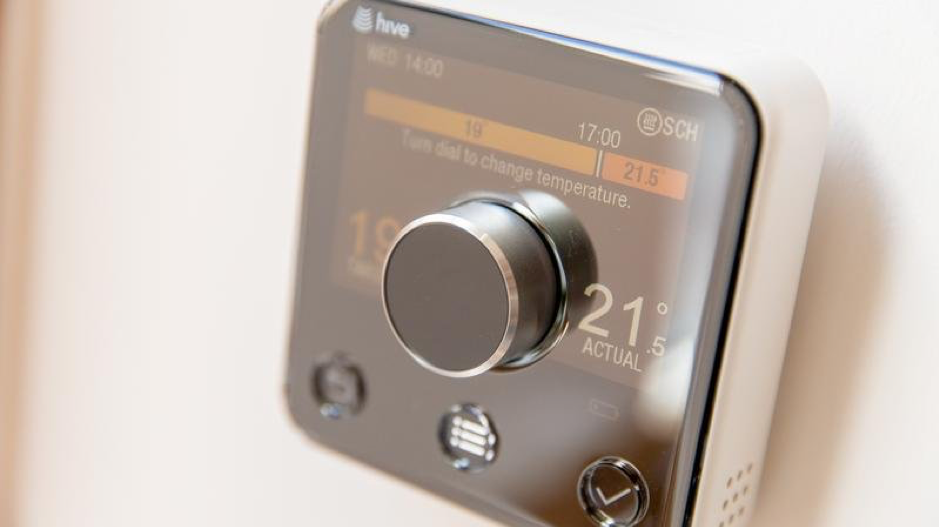
What are the coordinates of `control knob` in the screenshot? It's located at (417, 287).